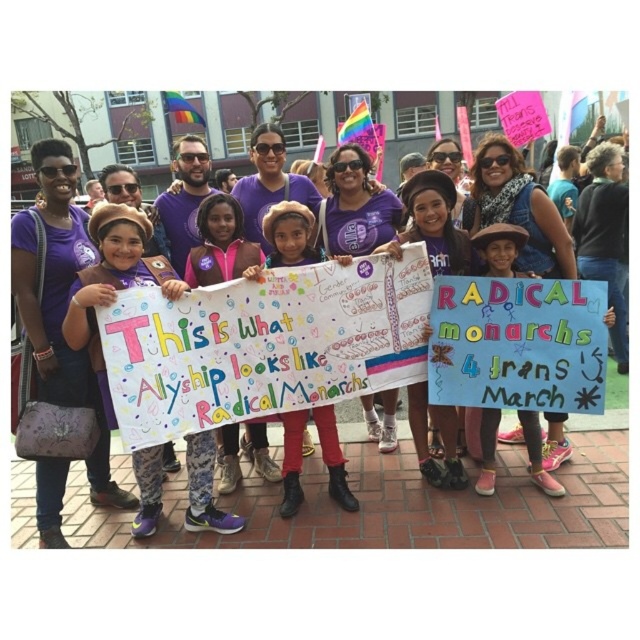
Question: Is matte cardboard sign at center positioned at the back of white paper sign at center?

Choices:
 (A) no
 (B) yes

Answer: (A)

Question: Which of the following is the closest to the observer?

Choices:
 (A) (474, 531)
 (B) (205, 525)
 (C) (294, 204)

Answer: (A)

Question: Which object appears farthest from the camera in this image?

Choices:
 (A) matte purple hat at center
 (B) purple fabric shirt at center
 (C) white paper sign at center
 (D) blue cardboard sign at center

Answer: (C)

Question: Can you confirm if matte cardboard sign at center is wider than blue cardboard sign at center?

Choices:
 (A) yes
 (B) no

Answer: (B)

Question: Can you confirm if matte purple hat at center is positioned to the right of white paper sign at center?

Choices:
 (A) yes
 (B) no

Answer: (B)

Question: Which point appears closest to the camera in this image?

Choices:
 (A) (268, 218)
 (B) (440, 500)

Answer: (B)